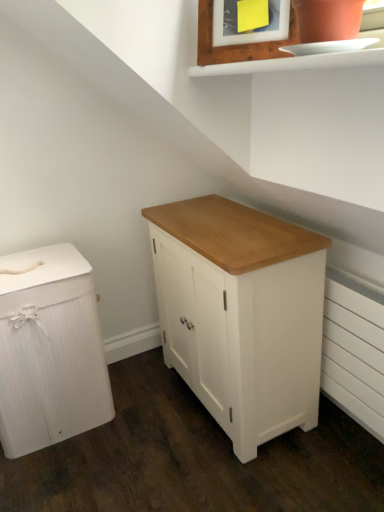
At what (x,y) coordinates should I click in order to perform the action: click on free spot in front of white painted wood cabinet at center, the first chest of drawers viewed from the right. Please return your answer as a coordinate pair (x, y). Looking at the image, I should click on (238, 473).